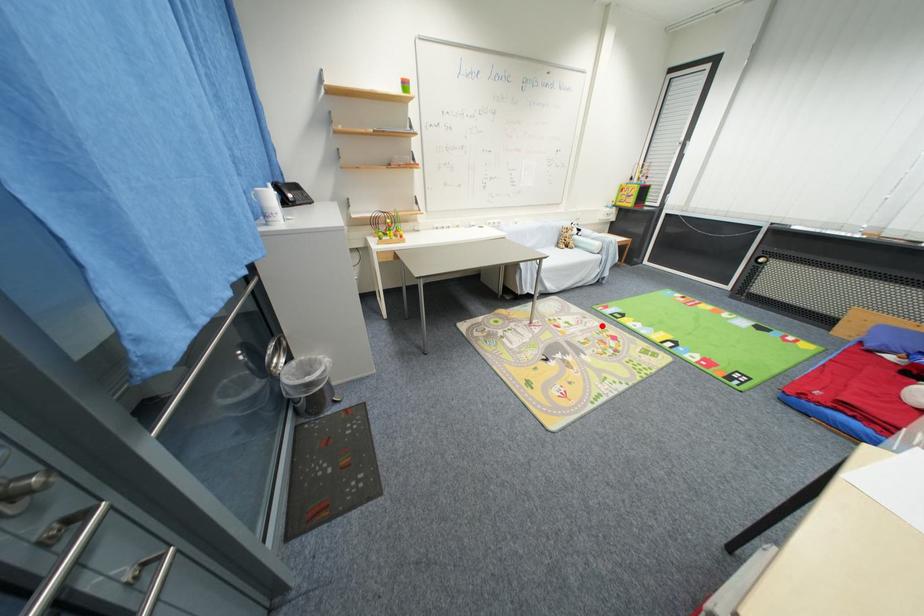
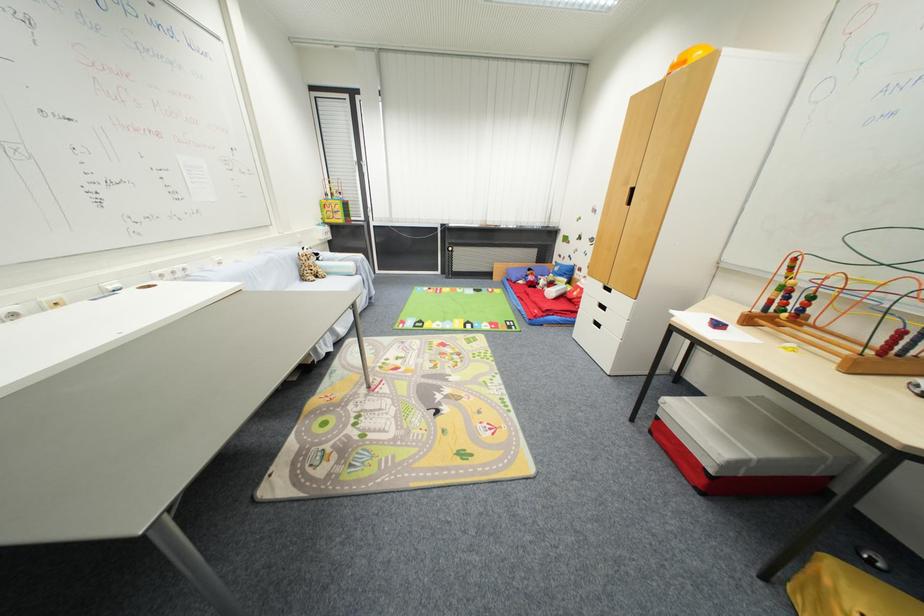
Where in the second image is the point corresponding to the highlighted location from the first image?

(423, 342)